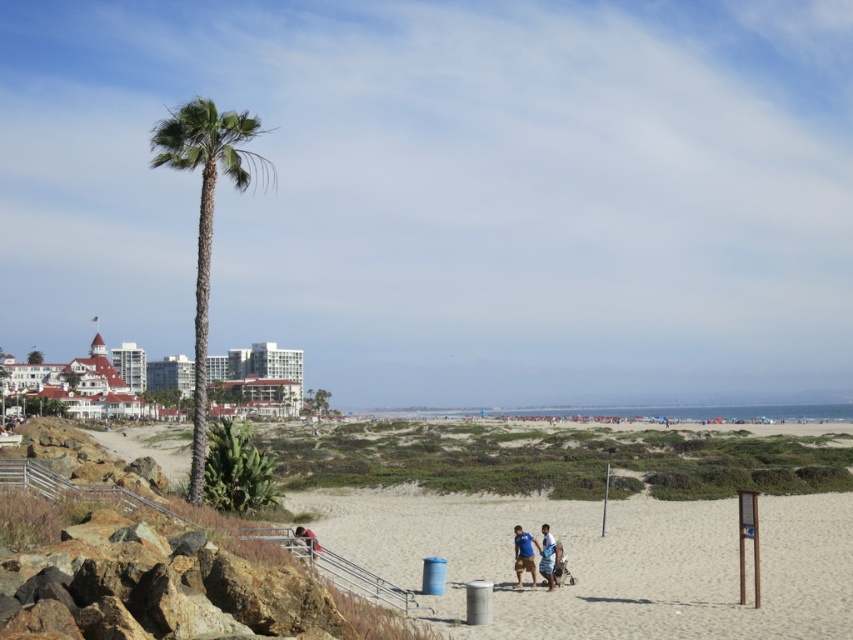
Can you confirm if green leafy palm tree at left is smaller than blue cotton shirt at center?

Answer: Actually, green leafy palm tree at left might be larger than blue cotton shirt at center.

The height and width of the screenshot is (640, 853). What do you see at coordinates (207, 220) in the screenshot? I see `green leafy palm tree at left` at bounding box center [207, 220].

The image size is (853, 640). What do you see at coordinates (207, 220) in the screenshot? I see `green leafy palm tree at left` at bounding box center [207, 220].

Find the location of a particular element. The image size is (853, 640). green leafy palm tree at left is located at coordinates (207, 220).

Does light beige sand at center come in front of blue cotton shirt at center?

That is True.

Between point (166, 438) and point (525, 532), which one is positioned in front?

Point (525, 532) is more forward.

Find the location of a particular element. light beige sand at center is located at coordinates (606, 561).

Who is taller, light beige sand at center or blue striped shorts at center?

light beige sand at center

Is point (711, 616) behind point (550, 564)?

No, it is in front of (550, 564).

Between point (747, 540) and point (549, 568), which one is positioned in front?

Point (747, 540) is in front.

Where is `light beige sand at center`? The height and width of the screenshot is (640, 853). light beige sand at center is located at coordinates (606, 561).